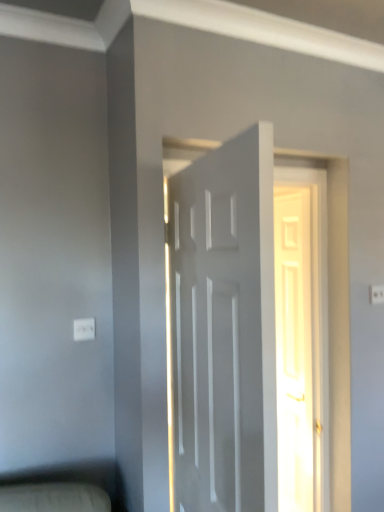
Question: Considering the relative sizes of white plastic electric outlet at upper right, the first electric outlet viewed from the back, and white plastic electric outlet at lower left, which is the 2th electric outlet in top-to-bottom order, in the image provided, is white plastic electric outlet at upper right, the first electric outlet viewed from the back, bigger than white plastic electric outlet at lower left, which is the 2th electric outlet in top-to-bottom order,?

Choices:
 (A) no
 (B) yes

Answer: (A)

Question: Is the depth of white plastic electric outlet at upper right, positioned as the first electric outlet in right-to-left order, greater than that of white plastic electric outlet at lower left, marked as the 1th electric outlet in a left-to-right arrangement?

Choices:
 (A) yes
 (B) no

Answer: (A)

Question: Is white plastic electric outlet at upper right, arranged as the 2th electric outlet when viewed from the left, at the right side of white plastic electric outlet at lower left, which is the 2th electric outlet in top-to-bottom order?

Choices:
 (A) yes
 (B) no

Answer: (A)

Question: From the image's perspective, is white plastic electric outlet at upper right, positioned as the first electric outlet in right-to-left order, located beneath white plastic electric outlet at lower left, marked as the 1th electric outlet in a left-to-right arrangement?

Choices:
 (A) yes
 (B) no

Answer: (B)

Question: From a real-world perspective, is white plastic electric outlet at upper right, which is the 2th electric outlet from front to back, on top of white plastic electric outlet at lower left, marked as the 1th electric outlet in a left-to-right arrangement?

Choices:
 (A) no
 (B) yes

Answer: (B)

Question: Can you confirm if white plastic electric outlet at upper right, arranged as the 2th electric outlet when viewed from the left, is positioned to the left of white plastic electric outlet at lower left, marked as the 1th electric outlet in a left-to-right arrangement?

Choices:
 (A) no
 (B) yes

Answer: (A)

Question: From a real-world perspective, does white glossy door at center, the second door when ordered from front to back, stand above white plastic electric outlet at upper right, which is the second electric outlet from bottom to top?

Choices:
 (A) no
 (B) yes

Answer: (A)

Question: Is white glossy door at center, the first door viewed from the right, placed right next to white plastic electric outlet at upper right, which is the 2th electric outlet from front to back?

Choices:
 (A) no
 (B) yes

Answer: (A)

Question: Does white glossy door at center, the second door when ordered from front to back, appear on the right side of white plastic electric outlet at upper right, positioned as the first electric outlet in right-to-left order?

Choices:
 (A) no
 (B) yes

Answer: (A)

Question: From a real-world perspective, is white glossy door at center, the second door when ordered from front to back, below white plastic electric outlet at upper right, arranged as the 2th electric outlet when viewed from the left?

Choices:
 (A) no
 (B) yes

Answer: (B)

Question: Considering the relative sizes of white glossy door at center, placed as the first door when sorted from back to front, and white plastic electric outlet at upper right, the first electric outlet viewed from the back, in the image provided, is white glossy door at center, placed as the first door when sorted from back to front, wider than white plastic electric outlet at upper right, the first electric outlet viewed from the back,?

Choices:
 (A) yes
 (B) no

Answer: (A)

Question: From the image's perspective, is white glossy door at center, placed as the first door when sorted from back to front, below white plastic electric outlet at upper right, arranged as the 2th electric outlet when viewed from the left?

Choices:
 (A) no
 (B) yes

Answer: (B)

Question: Does white matte door at center, the 2th door viewed from the back, have a greater width compared to white plastic electric outlet at lower left, which is counted as the first electric outlet, starting from the front?

Choices:
 (A) no
 (B) yes

Answer: (B)